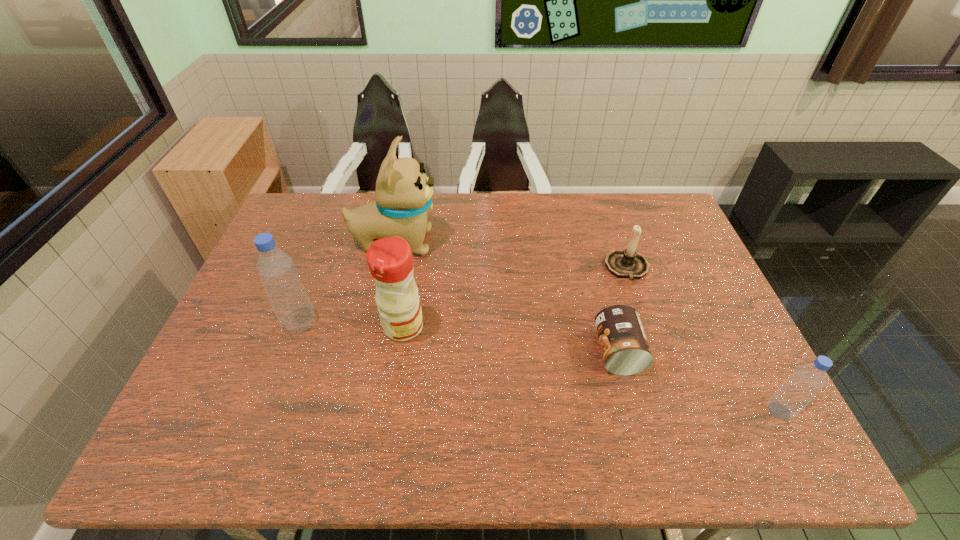
You are a GUI agent. You are given a task and a screenshot of the screen. Output one action in this format:
    pyautogui.click(x=<x>, y=<y>)
    Task: Click on the free space located on the face of the puppy
    The width and height of the screenshot is (960, 540).
    Given the screenshot: What is the action you would take?
    pyautogui.click(x=496, y=242)

You are a GUI agent. You are given a task and a screenshot of the screen. Output one action in this format:
    pyautogui.click(x=<x>, y=<y>)
    Task: Click on the free space located on the front of the candle holder
    This screenshot has height=540, width=960.
    Given the screenshot: What is the action you would take?
    pyautogui.click(x=646, y=325)

Identify the location of vacant space located 0.140m on the front of the condiment. Image resolution: width=960 pixels, height=540 pixels. (393, 391).

The width and height of the screenshot is (960, 540). Identify the location of vacant space located 0.070m on the front label of the can. (568, 352).

Where is `vacant space located on the front label of the can`? vacant space located on the front label of the can is located at coordinates (511, 352).

At what (x,y) coordinates should I click in order to perform the action: click on vacant position located on the front label of the can. Please return your answer as a coordinate pair (x, y). Looking at the image, I should click on (503, 352).

The height and width of the screenshot is (540, 960). What are the coordinates of `object situated at the far edge` in the screenshot? It's located at (403, 195).

Locate an element on the screen. The width and height of the screenshot is (960, 540). object positioned at the near edge is located at coordinates click(x=807, y=380).

Identify the location of object that is at the left edge. (276, 269).

The image size is (960, 540). I want to click on object present at the right edge, so [807, 380].